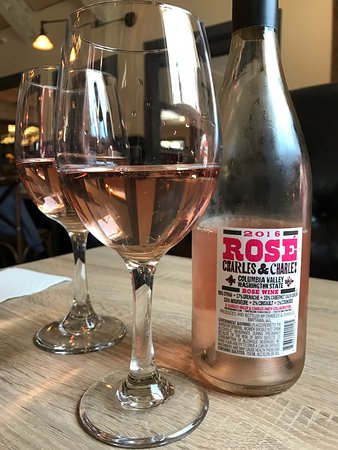
Find the location of a particular element. bottle of wine is located at coordinates (x=211, y=282).